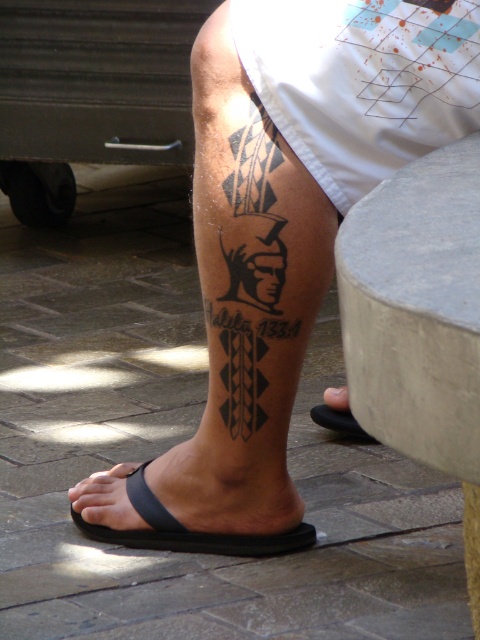
You are a shoe designer observing the image. You need to determine which sandal is taller between the black matte sandal at lower left and the black rubber sandal at lower left. Which one is taller?

The black matte sandal at lower left has a greater height compared to the black rubber sandal at lower left, so the black matte sandal at lower left is taller.

You are standing in an outdoor area and see both the black matte sandal at lower left and the black rubber sandal at lower left. Which sandal is nearer to you?

The black matte sandal at lower left is closer to the viewer than the black rubber sandal at lower left, so the black matte sandal at lower left is nearer to you.